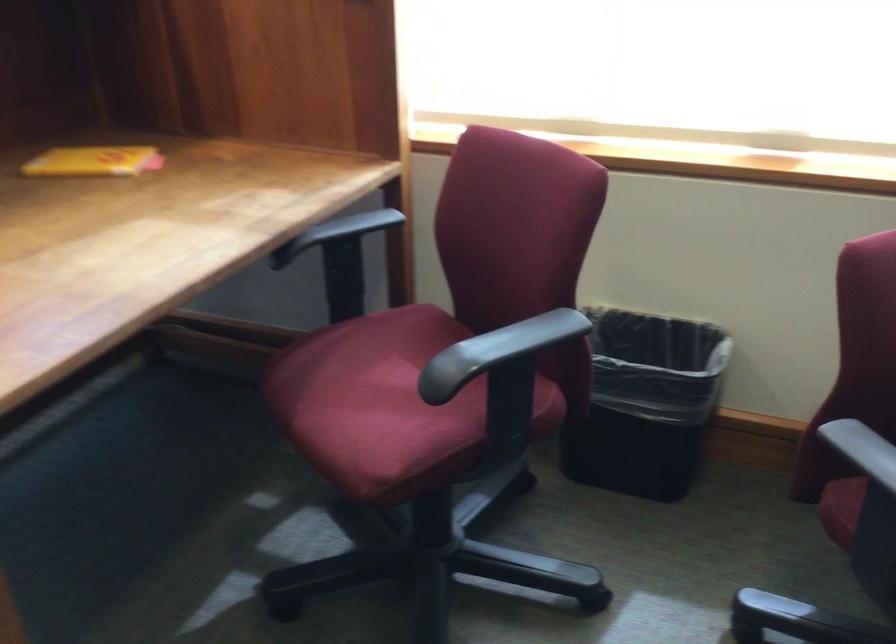
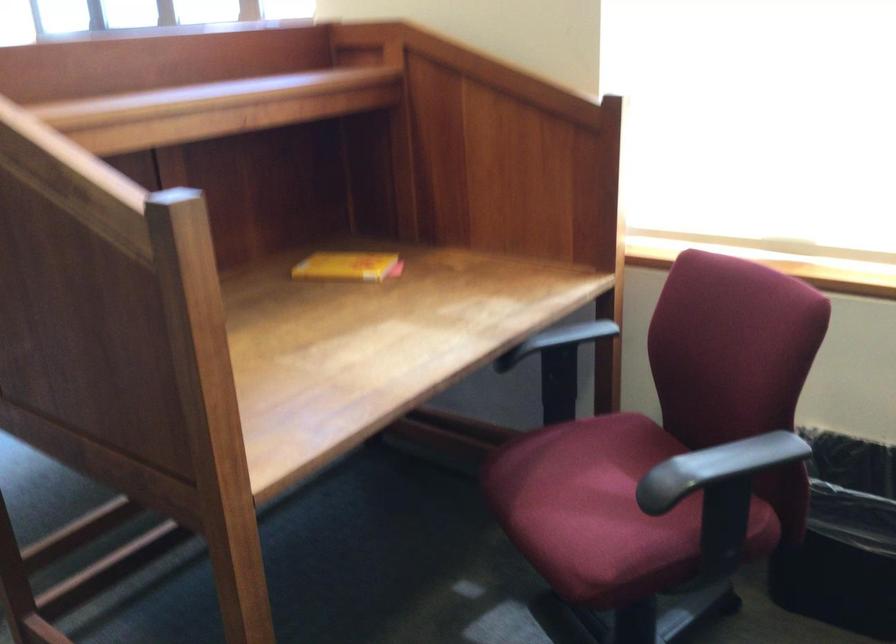
In the second image, find the point that corresponds to (496,348) in the first image.

(716, 468)